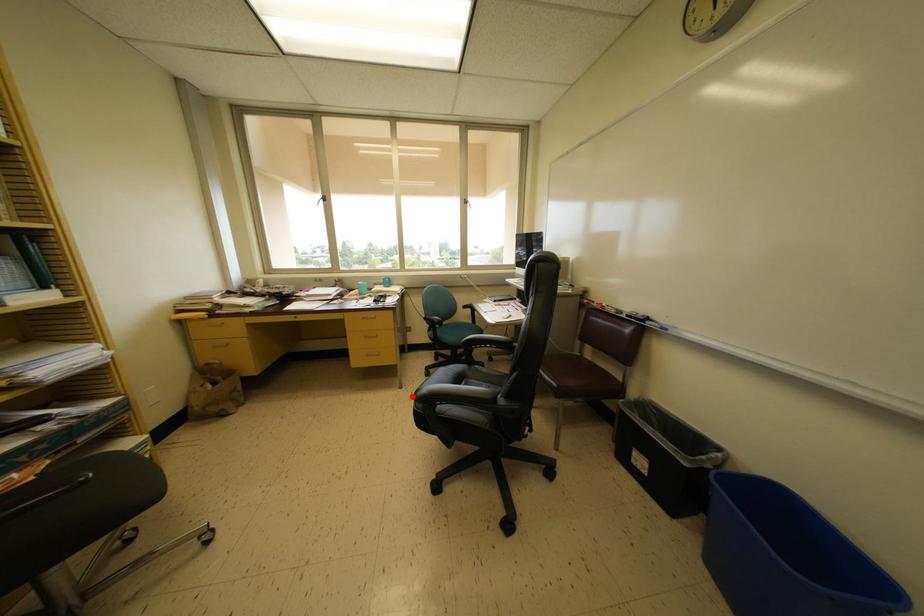
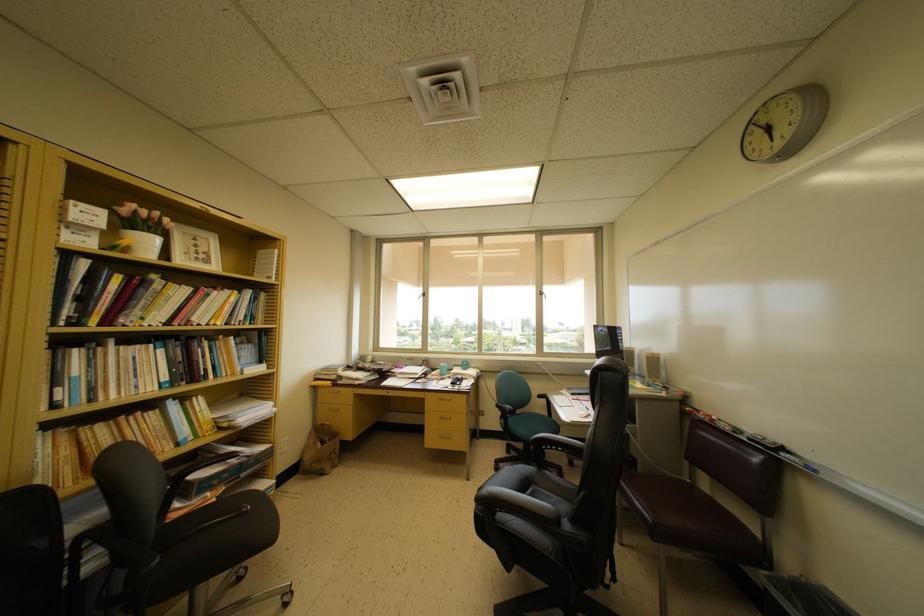
Where in the second image is the point corresponding to the highlighted location from the first image?

(479, 490)